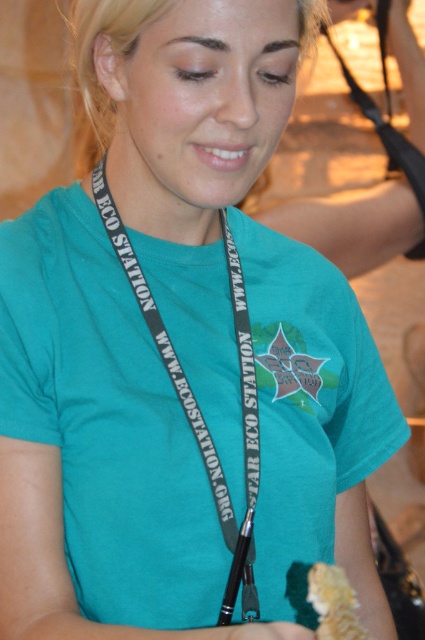
You are a photographer at an event and need to take a clear photo of the black fabric lanyard at center and the yellow crumbly food at lower right. Which object should you focus on first to ensure both are in focus?

You should focus on the black fabric lanyard at center first because it is positioned over the yellow crumbly food at lower right, meaning it is closer to the camera. By focusing on the closer object, the lanyard, the food will also be in focus due to the depth of field.

You are standing in the same room as the person in the image. If you want to look at the lanyard around their neck, which point should you focus on first, point A at coordinates point (184,186) or point B at coordinates point (419,161)?

You should focus on point A at coordinates point (184,186) first because it is in front of point B at coordinates point (419,161). Since the lanyard is around their neck, the closer point would be the one facing you.